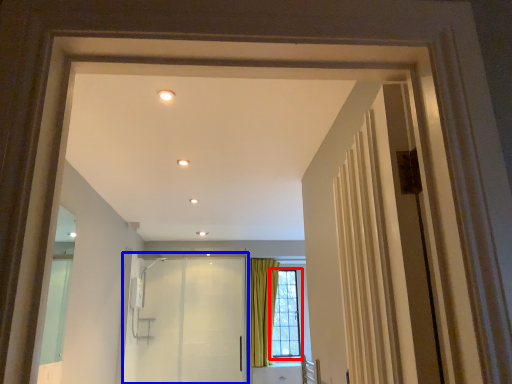
Question: Which point is further to the camera, window (highlighted by a red box) or elevator (highlighted by a blue box)?

Choices:
 (A) window
 (B) elevator

Answer: (A)